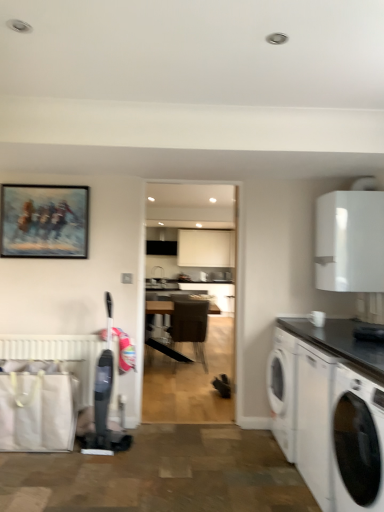
Question: Is white matte radiator at lower left at the left side of black glossy countertop at lower right?

Choices:
 (A) no
 (B) yes

Answer: (B)

Question: Are white matte radiator at lower left and black glossy countertop at lower right beside each other?

Choices:
 (A) yes
 (B) no

Answer: (B)

Question: From a real-world perspective, is white matte radiator at lower left located higher than black glossy countertop at lower right?

Choices:
 (A) yes
 (B) no

Answer: (A)

Question: Does white matte radiator at lower left have a smaller size compared to black glossy countertop at lower right?

Choices:
 (A) no
 (B) yes

Answer: (B)

Question: Does white matte radiator at lower left have a larger size compared to black glossy countertop at lower right?

Choices:
 (A) yes
 (B) no

Answer: (B)

Question: Looking at their shapes, would you say dark brown leather chair at center is wider or thinner than white matte cabinet at upper right?

Choices:
 (A) wide
 (B) thin

Answer: (A)

Question: In terms of height, does dark brown leather chair at center look taller or shorter compared to white matte cabinet at upper right?

Choices:
 (A) short
 (B) tall

Answer: (B)

Question: In the image, is dark brown leather chair at center positioned in front of or behind white matte cabinet at upper right?

Choices:
 (A) behind
 (B) front

Answer: (A)

Question: From a real-world perspective, relative to white matte cabinet at upper right, is dark brown leather chair at center vertically above or below?

Choices:
 (A) below
 (B) above

Answer: (A)

Question: Is white glossy washing machine at lower right to the left or to the right of oil painting at upper left in the image?

Choices:
 (A) right
 (B) left

Answer: (A)

Question: Is white glossy washing machine at lower right in front of or behind oil painting at upper left in the image?

Choices:
 (A) front
 (B) behind

Answer: (A)

Question: Choose the correct answer: Is white glossy washing machine at lower right inside oil painting at upper left or outside it?

Choices:
 (A) inside
 (B) outside

Answer: (B)

Question: Is point (364, 378) closer or farther from the camera than point (3, 198)?

Choices:
 (A) closer
 (B) farther

Answer: (A)

Question: Would you say dark brown leather chair at center is to the left or to the right of oil painting at upper left in the picture?

Choices:
 (A) right
 (B) left

Answer: (A)

Question: In terms of width, does dark brown leather chair at center look wider or thinner when compared to oil painting at upper left?

Choices:
 (A) wide
 (B) thin

Answer: (A)